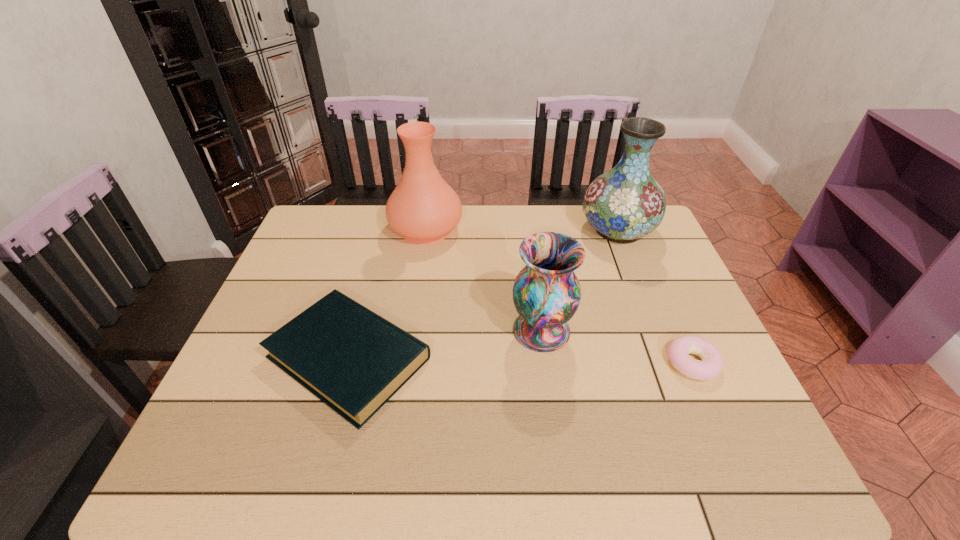
Locate an element on the screen. blank area located on the back of the shortest object is located at coordinates (662, 294).

The width and height of the screenshot is (960, 540). Find the location of `object that is at the left edge`. object that is at the left edge is located at coordinates (352, 359).

You are a GUI agent. You are given a task and a screenshot of the screen. Output one action in this format:
    pyautogui.click(x=<x>, y=<y>)
    Task: Click on the vase present at the right edge
    
    Given the screenshot: What is the action you would take?
    pyautogui.click(x=626, y=203)

The image size is (960, 540). Identify the location of doughnut at the right edge. (710, 367).

At what (x,y) coordinates should I click in order to perform the action: click on object that is positioned at the far right corner. Please return your answer as a coordinate pair (x, y). Image resolution: width=960 pixels, height=540 pixels. Looking at the image, I should click on (626, 203).

You are a GUI agent. You are given a task and a screenshot of the screen. Output one action in this format:
    pyautogui.click(x=<x>, y=<y>)
    Task: Click on the vacant space at the far edge of the desktop
    Image resolution: width=960 pixels, height=540 pixels.
    Given the screenshot: What is the action you would take?
    pyautogui.click(x=364, y=223)

This screenshot has height=540, width=960. Identify the location of free space at the left edge of the desktop. 323,252.

This screenshot has height=540, width=960. Find the location of `free location at the right edge`. free location at the right edge is located at coordinates (670, 384).

Identify the location of vacant area at the near left corner. The image size is (960, 540). (257, 439).

At what (x,y) coordinates should I click in order to perform the action: click on unoccupied position between the third object from right to left and the rightmost vase. Please return your answer as a coordinate pair (x, y). The image size is (960, 540). Looking at the image, I should click on (580, 280).